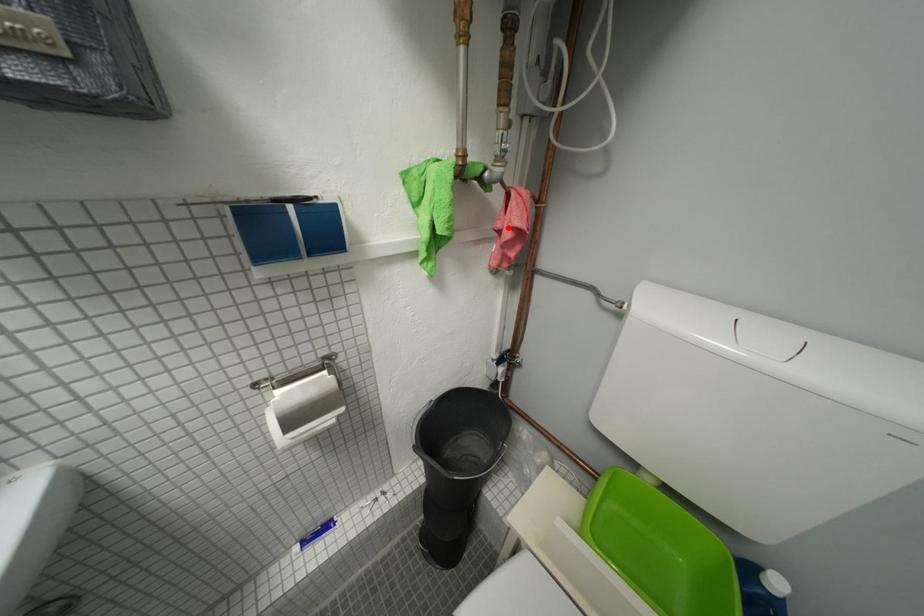
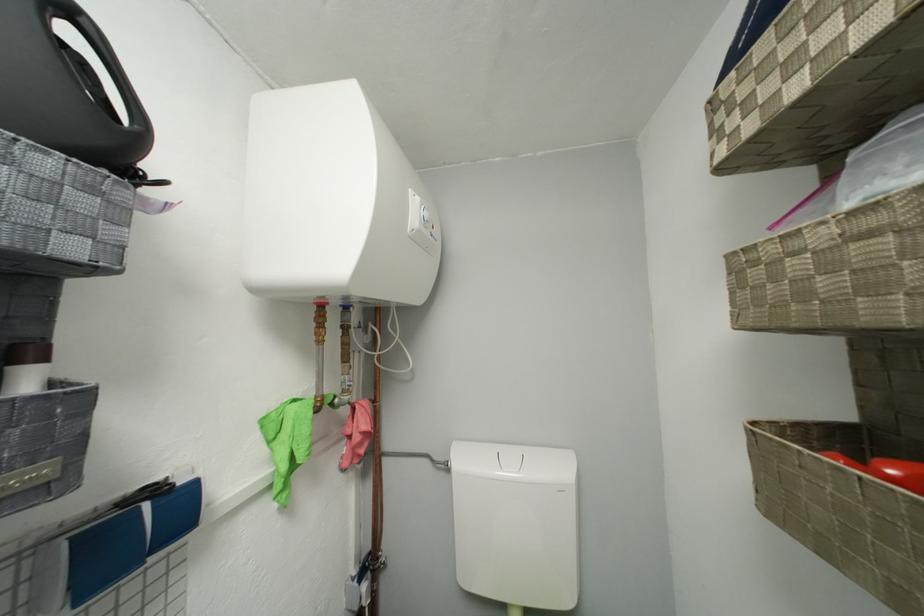
Where in the second image is the point corresponding to the highlighted location from the first image?

(358, 435)